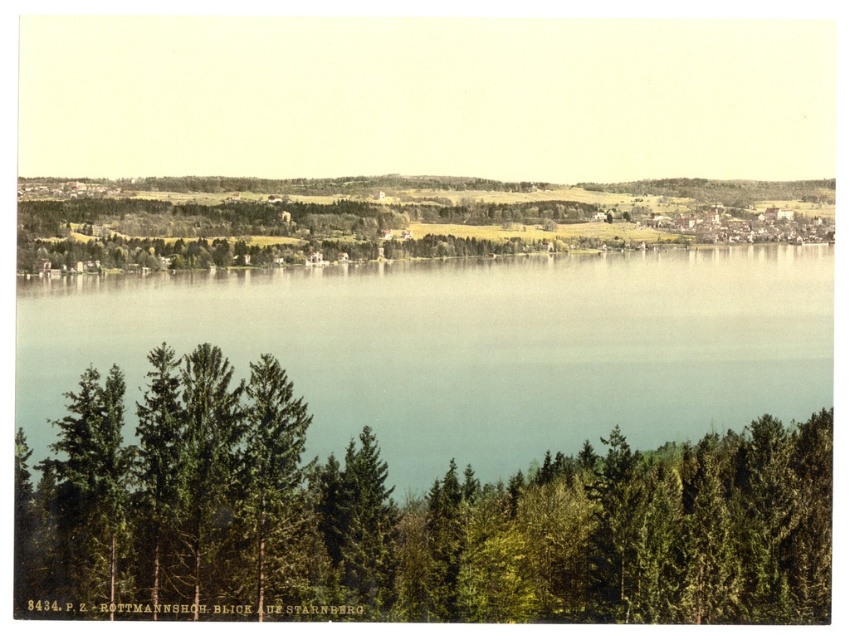
You are standing in the forest and see the green textured trees at lower center and the clear blue water at center. Which object is positioned to the right of the other?

The clear blue water at center is to the right of the green textured trees at lower center because the green textured trees at lower center is to the left of clear blue water at center.

You are standing at the center of the image and want to walk towards the point marked as point [404,518]. Which direction should you head to reach it?

The point [404,518] is located on green textured trees at lower center, so you should head towards the lower center direction to reach it.

You are a photographer planning to capture a wide landscape shot. You have a camera with a 35mm lens that can capture a horizontal field of view of 60 degrees. The green textured trees at lower center and the clear blue water at center are both in your frame. Given their relative widths, which object will occupy more of the horizontal space in your photo?

The clear blue water at center will occupy more horizontal space in the photo because the green textured trees at lower center has a lesser width compared to the clear blue water at center according to the description.